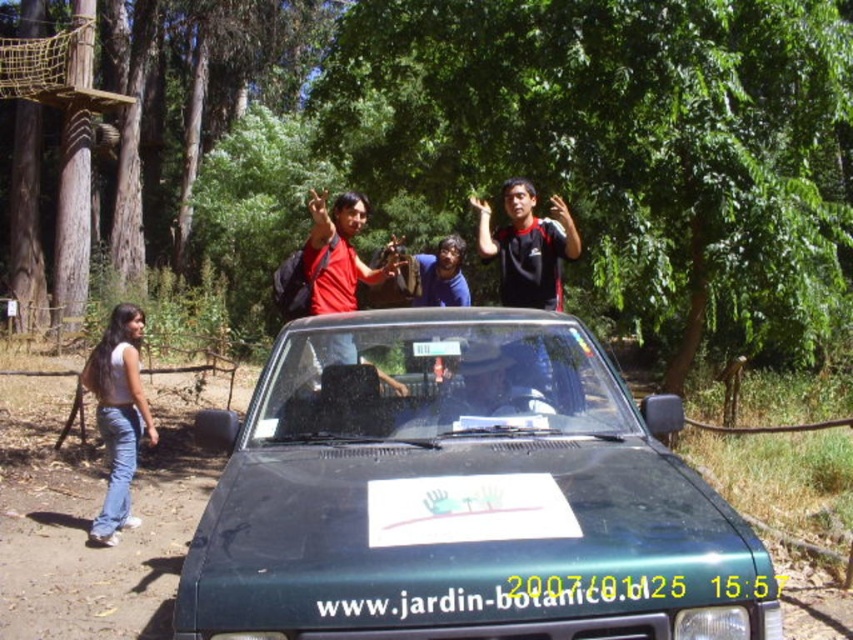
Is point (105, 371) positioned before point (311, 204)?

No, (105, 371) is further to viewer.

Can you confirm if denim jeans at left is bigger than matte red shirt at center?

No, denim jeans at left is not bigger than matte red shirt at center.

The width and height of the screenshot is (853, 640). Describe the element at coordinates (119, 416) in the screenshot. I see `denim jeans at left` at that location.

Image resolution: width=853 pixels, height=640 pixels. I want to click on denim jeans at left, so click(x=119, y=416).

Does green matte car at center have a lesser height compared to white plastic license plate at center?

In fact, green matte car at center may be taller than white plastic license plate at center.

Who is more forward, (291, 515) or (445, 349)?

Point (291, 515) is in front.

This screenshot has width=853, height=640. What are the coordinates of `green matte car at center` in the screenshot? It's located at (461, 496).

Between denim jeans at left and white plastic license plate at center, which one has more height?

With more height is denim jeans at left.

Is point (109, 314) positioned before point (457, 346)?

That is False.

The width and height of the screenshot is (853, 640). Find the location of `denim jeans at left`. denim jeans at left is located at coordinates click(x=119, y=416).